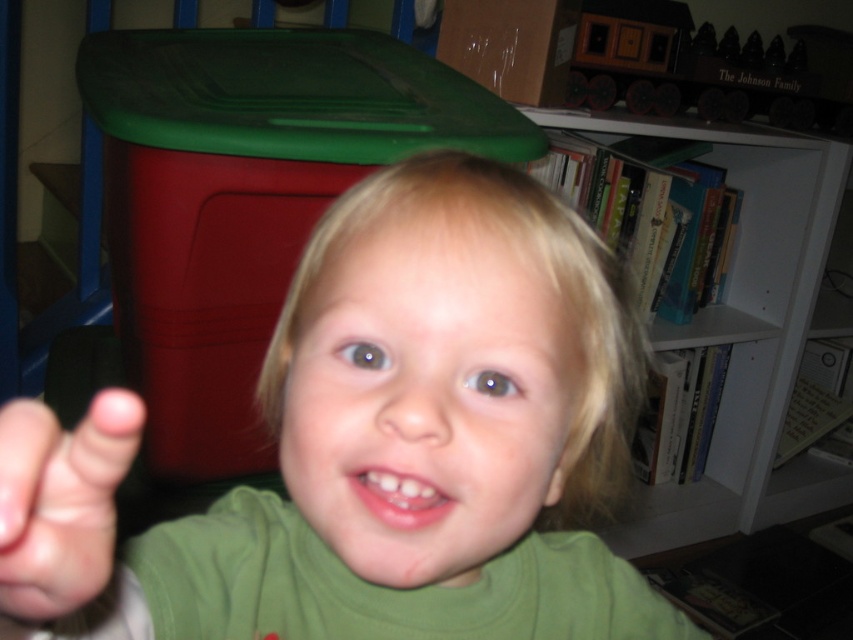
What do you see at coordinates (376, 444) in the screenshot?
I see `green matte shirt at center` at bounding box center [376, 444].

Does green matte shirt at center appear on the left side of white matte bookshelf at upper right?

Correct, you'll find green matte shirt at center to the left of white matte bookshelf at upper right.

Does point (158, 621) come in front of point (764, 205)?

Yes, it is.

You are a GUI agent. You are given a task and a screenshot of the screen. Output one action in this format:
    pyautogui.click(x=<x>, y=<y>)
    Task: Click on the green matte shirt at center
    The height and width of the screenshot is (640, 853).
    Given the screenshot: What is the action you would take?
    pyautogui.click(x=376, y=444)

Between point (16, 518) and point (33, 481), which one is positioned in front?

Positioned in front is point (16, 518).

Who is more distant from viewer, (x=518, y=612) or (x=21, y=448)?

The point (x=518, y=612) is more distant.

Locate an element on the screen. This screenshot has width=853, height=640. green matte shirt at center is located at coordinates (376, 444).

Which is behind, point (758, 240) or point (91, 576)?

The point (758, 240) is more distant.

I want to click on white matte bookshelf at upper right, so click(x=746, y=330).